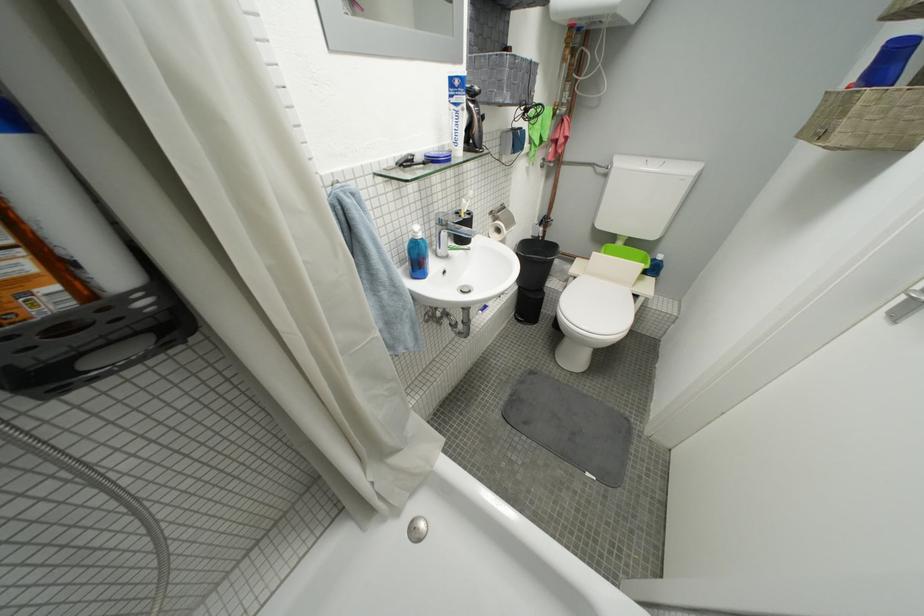
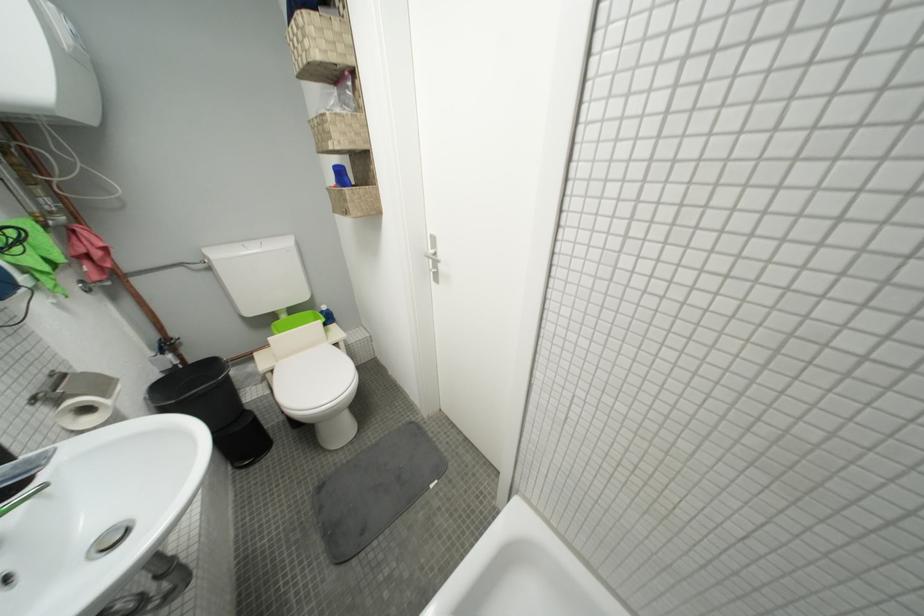
The point at (584, 281) is marked in the first image. Where is the corresponding point in the second image?

(281, 373)